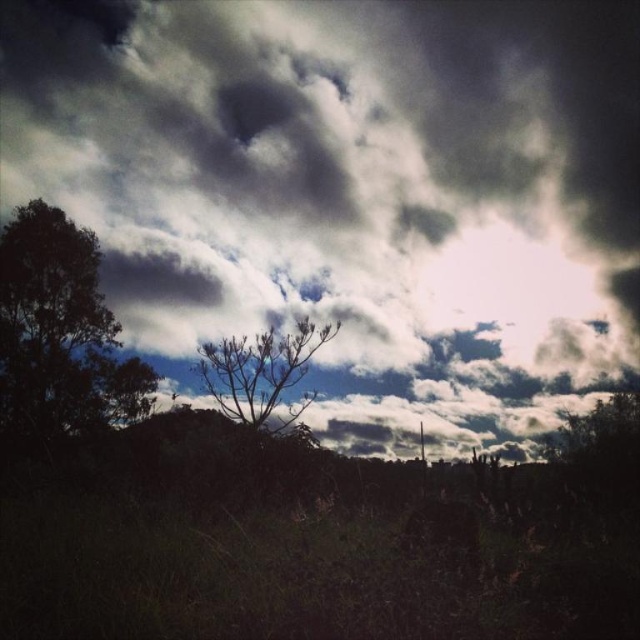
Question: From the image, what is the correct spatial relationship of dark green leafy tree at left in relation to brown textured tree at center?

Choices:
 (A) above
 (B) below

Answer: (A)

Question: Does dark cloudy sky at upper center have a lesser width compared to brown textured tree at center?

Choices:
 (A) no
 (B) yes

Answer: (A)

Question: Can you confirm if dark cloudy sky at upper center is positioned to the left of brown textured tree at center?

Choices:
 (A) no
 (B) yes

Answer: (B)

Question: Which point appears closest to the camera in this image?

Choices:
 (A) (291, 189)
 (B) (234, 376)
 (C) (49, 225)

Answer: (B)

Question: Estimate the real-world distances between objects in this image. Which object is farther from the dark cloudy sky at upper center?

Choices:
 (A) dark green leafy tree at left
 (B) brown textured tree at center

Answer: (B)

Question: Which point is farther to the camera?

Choices:
 (A) (276, 426)
 (B) (584, 260)

Answer: (B)